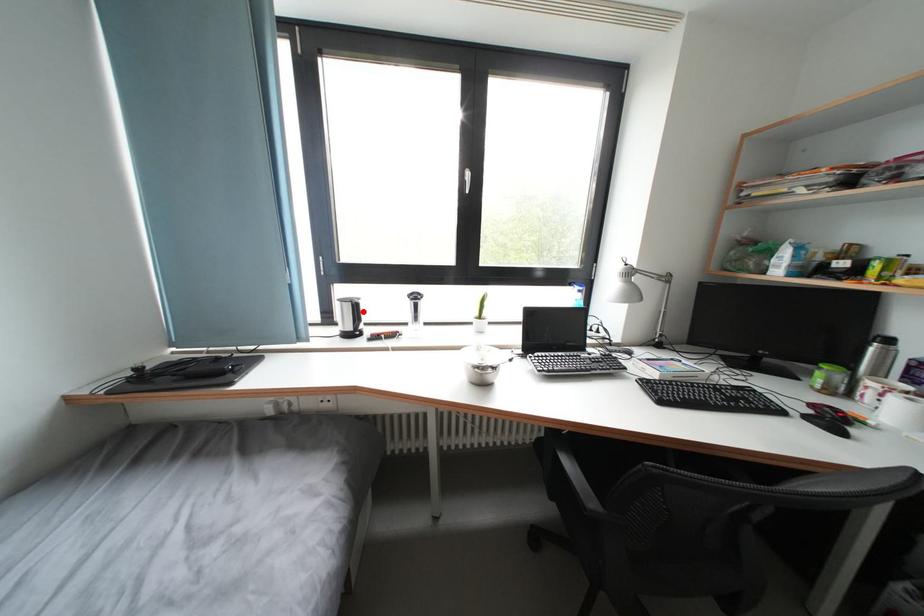
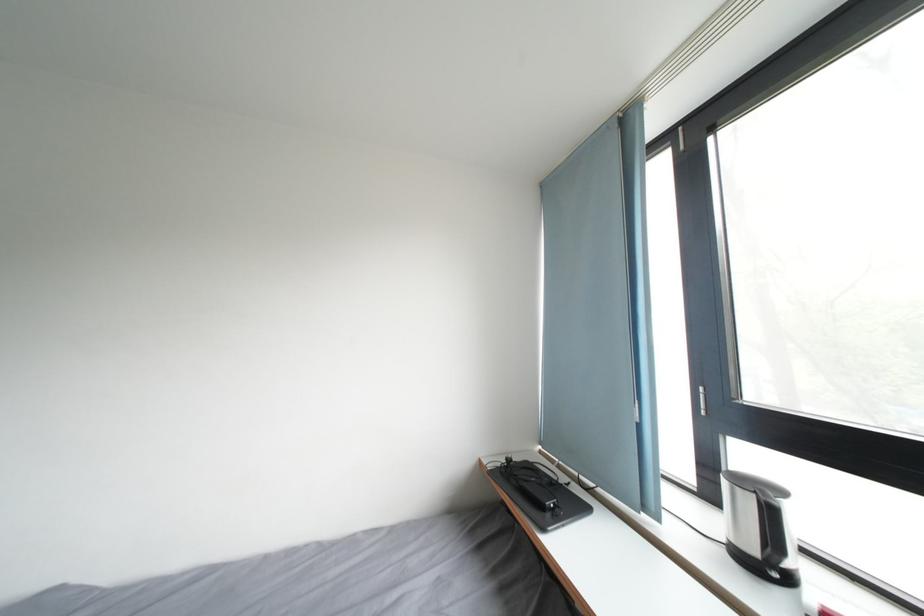
The point at the highlighted location is marked in the first image. Where is the corresponding point in the second image?

(776, 517)